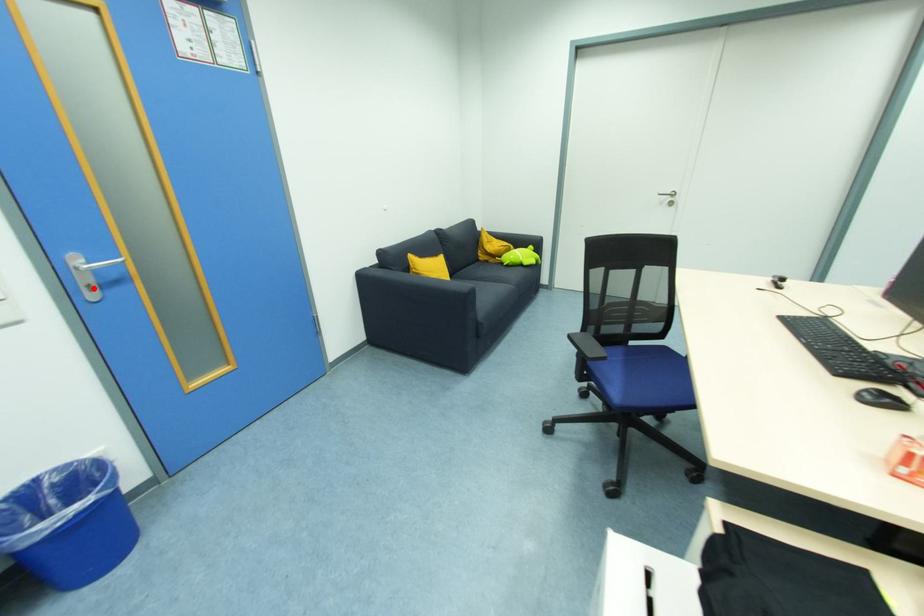
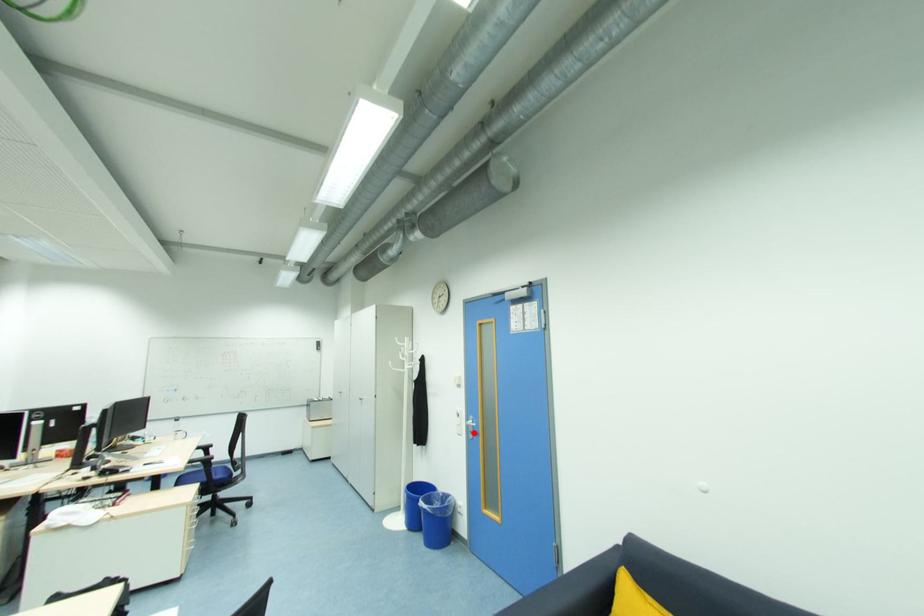
I am providing you with two images of the same scene from different viewpoints. A red point is marked on the first image and another point is marked on the second image. Does the point marked in image1 correspond to the same location as the one in image2?

Yes